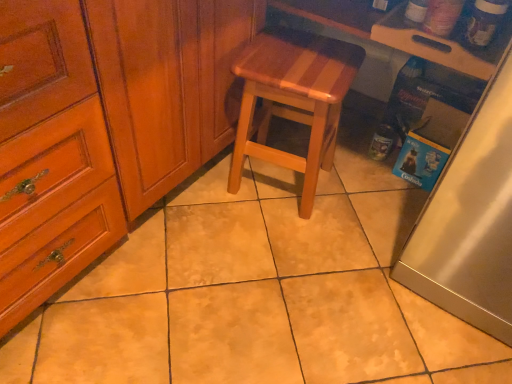
The image size is (512, 384). I want to click on vacant location below natural wood stool at center (from a real-world perspective), so click(275, 184).